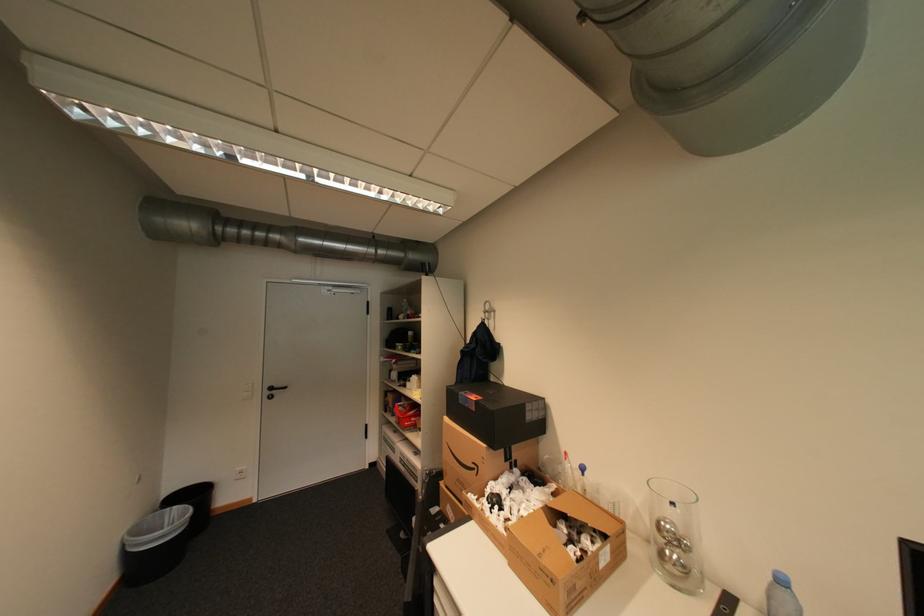
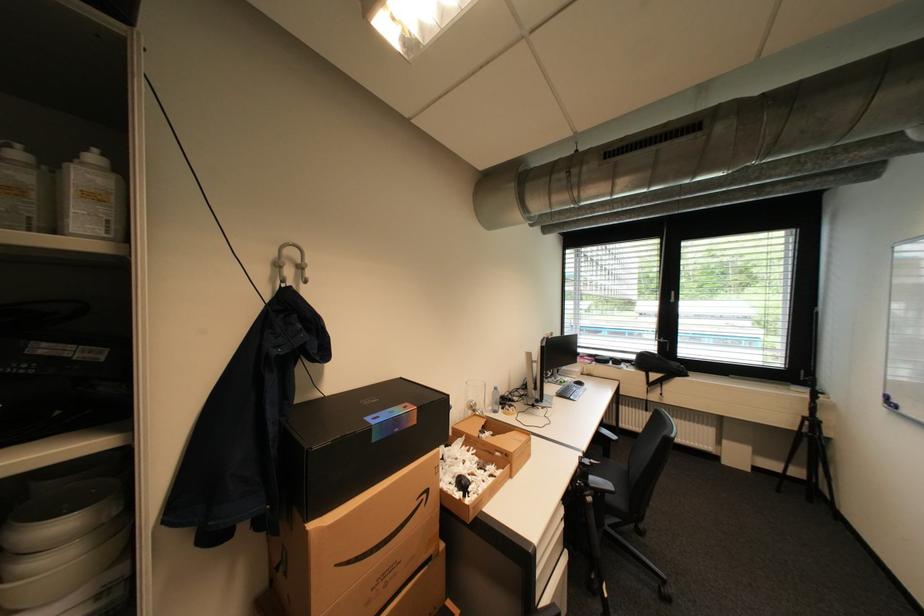
The point at (x=675, y=523) is marked in the first image. Where is the corresponding point in the second image?

(480, 402)